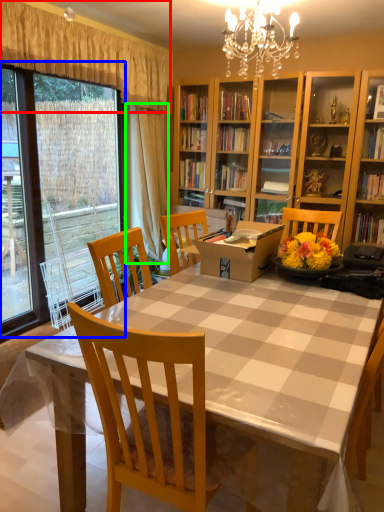
Question: Estimate the real-world distances between objects in this image. Which object is closer to curtain (highlighted by a red box), glass door (highlighted by a blue box) or curtain (highlighted by a green box)?

Choices:
 (A) glass door
 (B) curtain

Answer: (B)